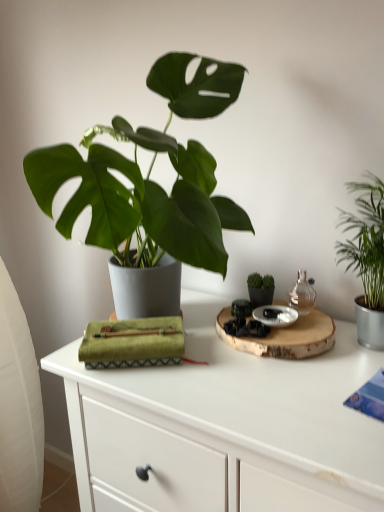
Question: Is white matte table at center thinner than green leafy plant at right?

Choices:
 (A) yes
 (B) no

Answer: (B)

Question: From a real-world perspective, is white matte table at center positioned over green leafy plant at right based on gravity?

Choices:
 (A) yes
 (B) no

Answer: (B)

Question: Is white matte table at center oriented away from green leafy plant at right?

Choices:
 (A) no
 (B) yes

Answer: (A)

Question: Can we say white matte table at center lies outside green leafy plant at right?

Choices:
 (A) yes
 (B) no

Answer: (A)

Question: From the image's perspective, is white matte table at center located above green leafy plant at right?

Choices:
 (A) no
 (B) yes

Answer: (A)

Question: Does point (306, 286) appear closer or farther from the camera than point (158, 393)?

Choices:
 (A) farther
 (B) closer

Answer: (A)

Question: Looking at the image, does transparent glass bottle at upper right seem bigger or smaller compared to white matte table at center?

Choices:
 (A) small
 (B) big

Answer: (A)

Question: From a real-world perspective, relative to white matte table at center, is transparent glass bottle at upper right vertically above or below?

Choices:
 (A) below
 (B) above

Answer: (B)

Question: Considering the positions of transparent glass bottle at upper right and white matte table at center in the image, is transparent glass bottle at upper right taller or shorter than white matte table at center?

Choices:
 (A) tall
 (B) short

Answer: (B)

Question: From the image's perspective, is green leafy plant at right above or below transparent glass bottle at upper right?

Choices:
 (A) above
 (B) below

Answer: (A)

Question: Is green leafy plant at right situated inside transparent glass bottle at upper right or outside?

Choices:
 (A) inside
 (B) outside

Answer: (B)

Question: Is green leafy plant at right bigger or smaller than transparent glass bottle at upper right?

Choices:
 (A) small
 (B) big

Answer: (B)

Question: Is green leafy plant at right in front of or behind transparent glass bottle at upper right in the image?

Choices:
 (A) behind
 (B) front

Answer: (B)

Question: From the image's perspective, is green leafy plant at right positioned above or below white matte table at center?

Choices:
 (A) above
 (B) below

Answer: (A)

Question: Is green leafy plant at right to the left or to the right of white matte table at center in the image?

Choices:
 (A) left
 (B) right

Answer: (B)